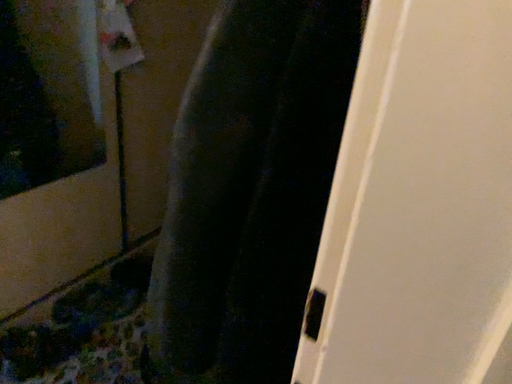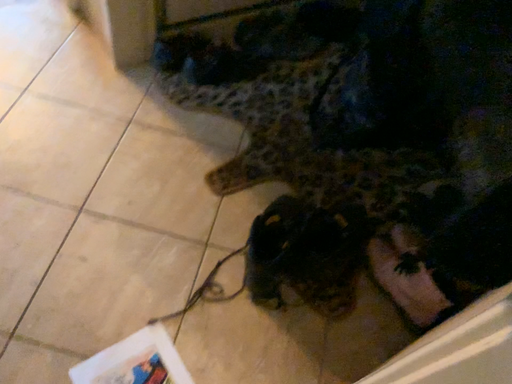
Question: Which way did the camera rotate in the video?

Choices:
 (A) rotated right
 (B) rotated left

Answer: (B)